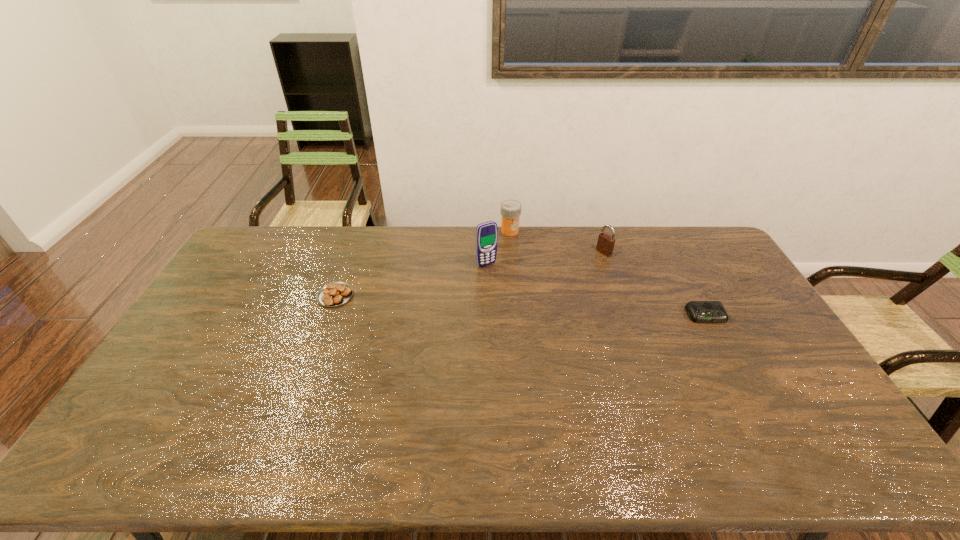
This screenshot has height=540, width=960. Find the location of `free space on the desktop that is between the pastry and the alarm clock and is positioned on the front-facing side of the padlock`. free space on the desktop that is between the pastry and the alarm clock and is positioned on the front-facing side of the padlock is located at coordinates (511, 305).

I want to click on vacant space on the desktop that is between the leftmost object and the alarm clock and is positioned on the label side of the medicine, so click(x=536, y=306).

Image resolution: width=960 pixels, height=540 pixels. I want to click on free space on the desktop that is between the pastry and the alarm clock and is positioned on the front-facing side of the third nearest object, so coord(516,305).